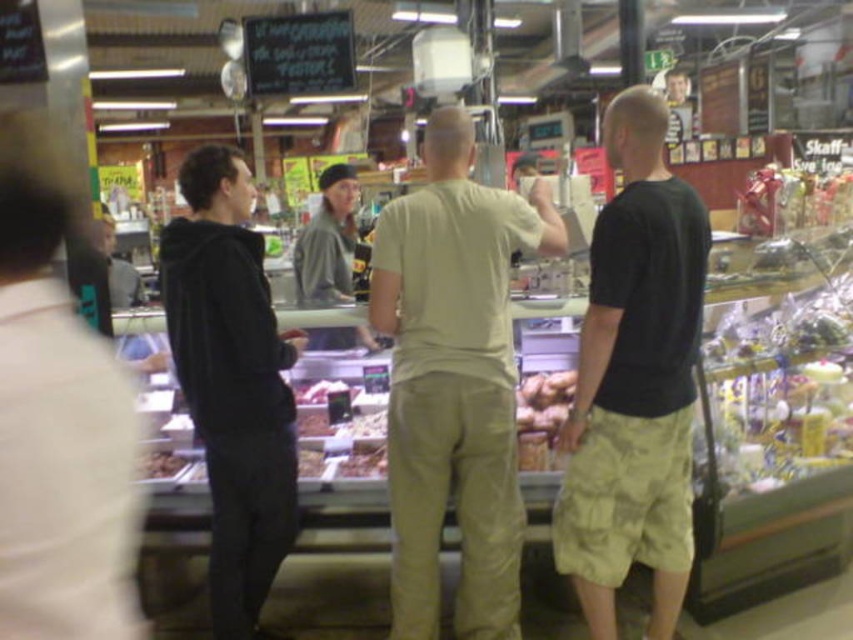
Can you confirm if light beige cotton t-shirt at center is positioned to the left of black matte hoodie at left?

In fact, light beige cotton t-shirt at center is to the right of black matte hoodie at left.

Can you confirm if light beige cotton t-shirt at center is positioned to the right of black matte hoodie at left?

Correct, you'll find light beige cotton t-shirt at center to the right of black matte hoodie at left.

Who is more distant from viewer, (433, 557) or (245, 566)?

Positioned behind is point (245, 566).

Where is `light beige cotton t-shirt at center`? The width and height of the screenshot is (853, 640). light beige cotton t-shirt at center is located at coordinates (454, 381).

Measure the distance between golden brown bread at center and brown textured meat at center.

The distance of golden brown bread at center from brown textured meat at center is 4.06 feet.

Is golden brown bread at center positioned before brown textured meat at center?

That is True.

Who is more distant from viewer, (544, 394) or (146, 456)?

The point (544, 394) is more distant.

The height and width of the screenshot is (640, 853). In order to click on golden brown bread at center in this screenshot , I will do `click(541, 416)`.

Does point (608, 145) come behind point (548, 461)?

No.

Describe the element at coordinates (634, 380) in the screenshot. Image resolution: width=853 pixels, height=640 pixels. I see `black cotton t-shirt at center` at that location.

Does point (619, 134) come closer to viewer compared to point (518, 458)?

Yes, it is.

At what (x,y) coordinates should I click in order to perform the action: click on black cotton t-shirt at center. Please return your answer as a coordinate pair (x, y). Looking at the image, I should click on (634, 380).